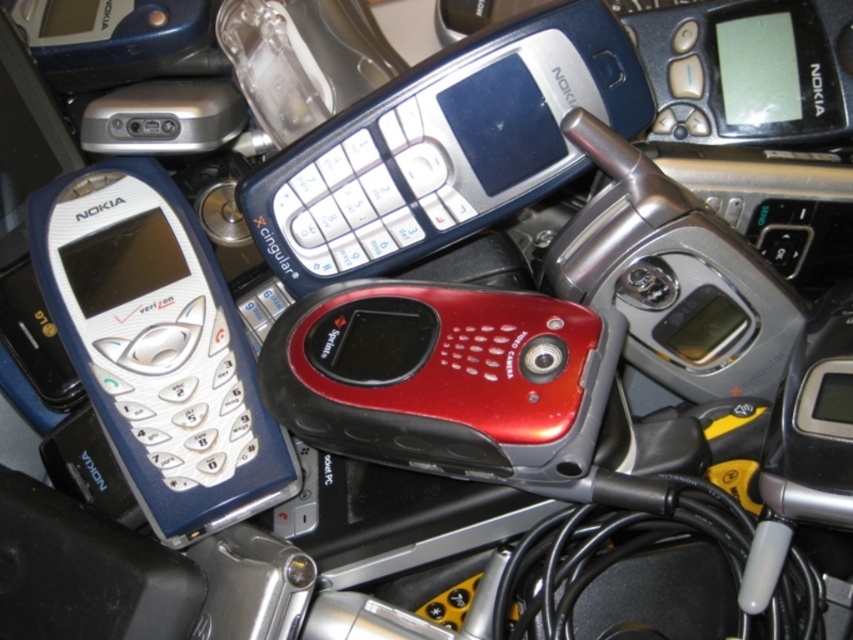
Question: Which point appears farthest from the camera in this image?

Choices:
 (A) (106, 433)
 (B) (534, 145)

Answer: (B)

Question: Which point is farther from the camera taking this photo?

Choices:
 (A) (367, 177)
 (B) (419, 426)

Answer: (A)

Question: Which of the following is the farthest from the observer?

Choices:
 (A) (428, 461)
 (B) (346, 273)

Answer: (B)

Question: Is metallic blue nokia phone at upper center behind shiny red plastic phone at center?

Choices:
 (A) yes
 (B) no

Answer: (A)

Question: Can you confirm if metallic blue nokia phone at upper center is thinner than matte silver phone at left?

Choices:
 (A) yes
 (B) no

Answer: (B)

Question: Does matte silver phone at left have a lesser width compared to shiny red plastic phone at center?

Choices:
 (A) no
 (B) yes

Answer: (B)